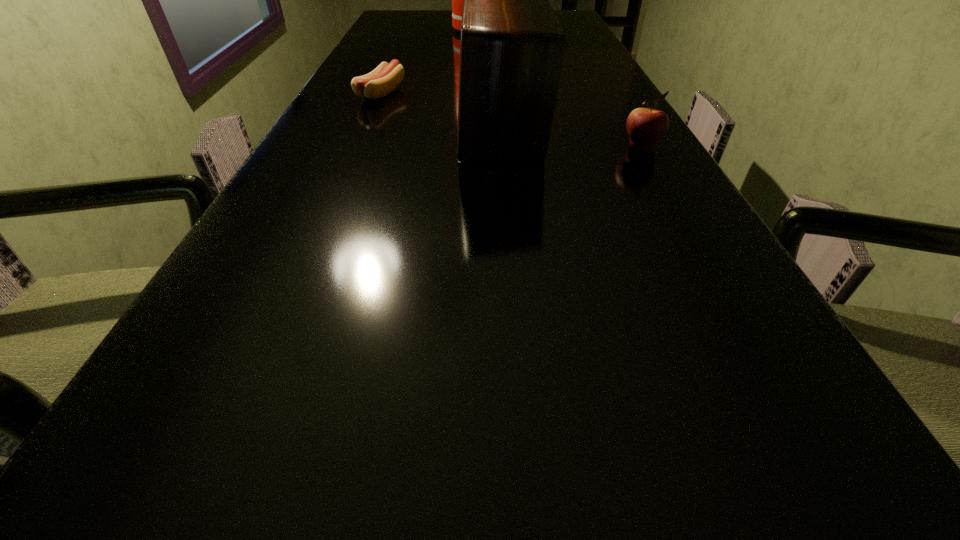
This screenshot has height=540, width=960. Find the location of `vacant area located 0.210m on the front-facing side of the third shortest object`. vacant area located 0.210m on the front-facing side of the third shortest object is located at coordinates (368, 123).

At what (x,y) coordinates should I click in order to perform the action: click on free space located 0.290m on the left of the third tallest object. Please return your answer as a coordinate pair (x, y). The width and height of the screenshot is (960, 540). Looking at the image, I should click on (482, 149).

You are a GUI agent. You are given a task and a screenshot of the screen. Output one action in this format:
    pyautogui.click(x=<x>, y=<y>)
    Task: Click on the vacant area located on the front of the shortest object
    The height and width of the screenshot is (540, 960).
    Given the screenshot: What is the action you would take?
    pyautogui.click(x=358, y=146)

The width and height of the screenshot is (960, 540). In order to click on object present at the far edge in this screenshot , I will do `click(457, 0)`.

Image resolution: width=960 pixels, height=540 pixels. Find the location of `object that is at the left edge`. object that is at the left edge is located at coordinates (380, 82).

Locate an element on the screen. object that is at the right edge is located at coordinates (645, 126).

In the image, there is a desktop. What are the coordinates of `vacant region at the left edge` in the screenshot? It's located at (311, 133).

This screenshot has height=540, width=960. I want to click on vacant space at the right edge of the desktop, so click(x=586, y=33).

Find the location of `vacant space at the far left corner`. vacant space at the far left corner is located at coordinates coord(395,21).

You are a GUI agent. You are given a task and a screenshot of the screen. Output one action in this format:
    pyautogui.click(x=<x>, y=<y>)
    Task: Click on the vacant region at the far right corner
    The width and height of the screenshot is (960, 540).
    Given the screenshot: What is the action you would take?
    pyautogui.click(x=572, y=17)